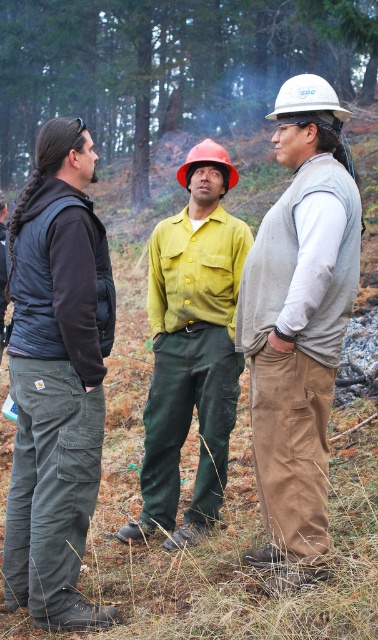
You are a safety inspector in this forest area. You notice the matte yellow shirt at center and the white hard hat at center. According to safety regulations, the minimum required distance between a worker and their hard hat must be no more than 5 feet to ensure quick access. Is the current distance compliant with the regulation?

The distance between the matte yellow shirt at center and the white hard hat at center is 5.98 feet, which exceeds the 5 feet maximum allowed. Therefore, it is not compliant with the safety regulation.

You are a hiker who wants to take a photo of the orange hard hat at center and the green leafy tree at upper center. Which object should you zoom in on to capture both in the frame without moving your camera?

The green leafy tree at upper center has a larger width than the orange hard hat at center, so you should zoom in on the orange hard hat at center to include both in the frame.

You are standing in a forest area and want to locate the green leafy tree at upper center. Based on the coordinates provided, can you determine its position relative to the other elements in the scene?

The green leafy tree at upper center is located at coordinates 0.105 on the x and 0.442 on the y axis, which places it in the upper central area of the scene.